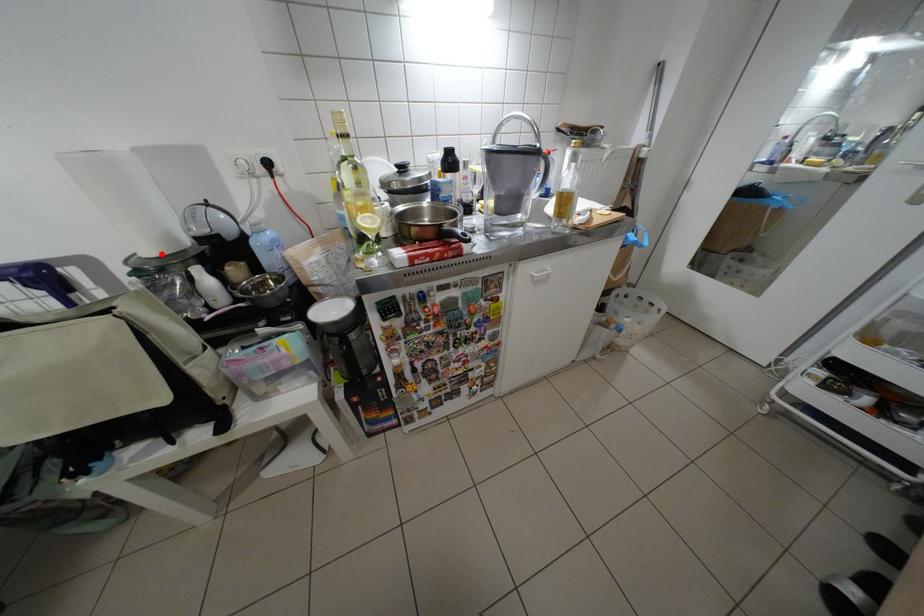
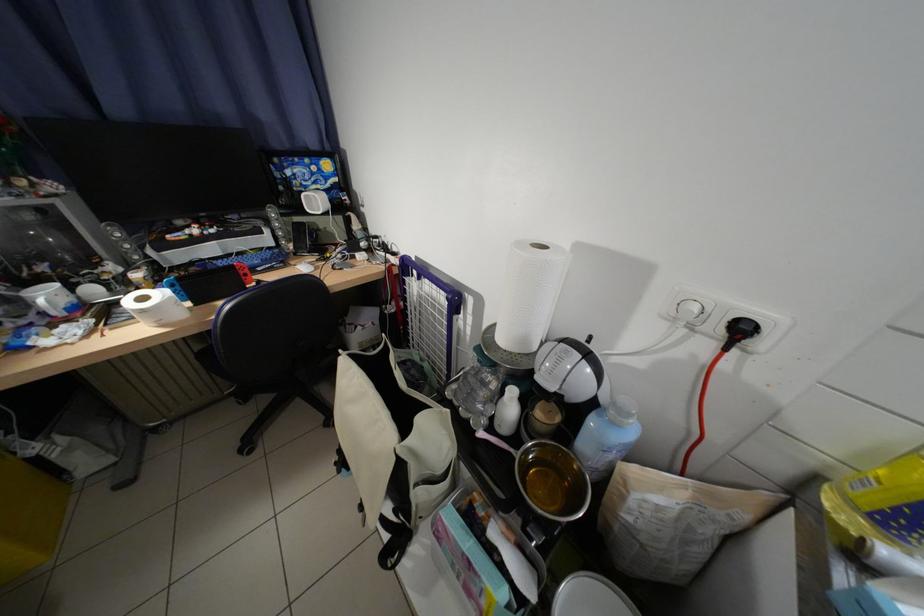
In the second image, find the point that corresponds to the highlighted location in the first image.

(514, 341)